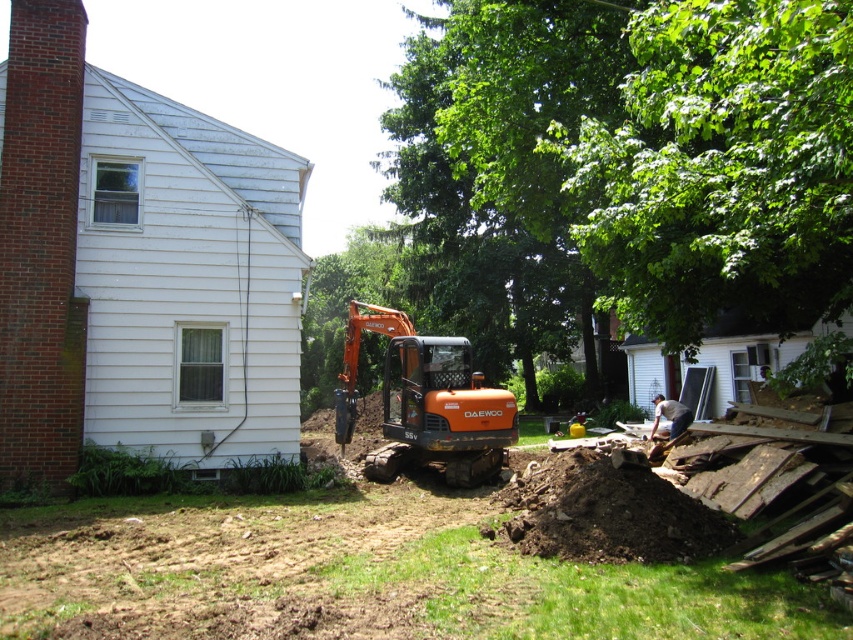
Question: Based on their relative distances, which object is farther from the orange metallic excavator at center?

Choices:
 (A) orange matte excavator at center
 (B) brown/dry soil at lower right

Answer: (A)

Question: From the image, what is the correct spatial relationship of orange metallic excavator at center in relation to orange matte excavator at center?

Choices:
 (A) below
 (B) above

Answer: (A)

Question: Which of the following is the farthest from the observer?

Choices:
 (A) [x=567, y=564]
 (B) [x=585, y=468]

Answer: (B)

Question: Which of these objects is positioned farthest from the dark brown wood at lower right?

Choices:
 (A) brown/dry soil at lower right
 (B) orange metallic excavator at center

Answer: (B)

Question: Does orange metallic excavator at center have a greater width compared to brown/dry soil at lower right?

Choices:
 (A) no
 (B) yes

Answer: (B)

Question: Is brown/dry soil at lower right in front of dark brown wood at lower right?

Choices:
 (A) no
 (B) yes

Answer: (B)